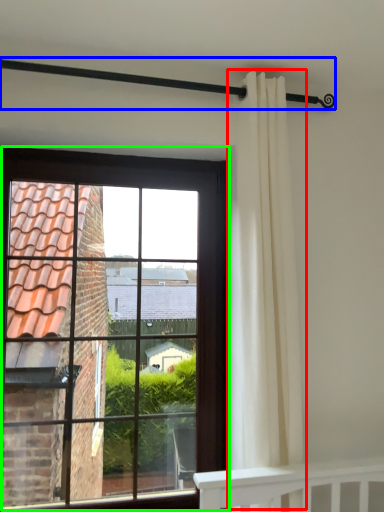
Question: Estimate the real-world distances between objects in this image. Which object is farther from curtain (highlighted by a red box), balustrade (highlighted by a blue box) or window (highlighted by a green box)?

Choices:
 (A) balustrade
 (B) window

Answer: (B)